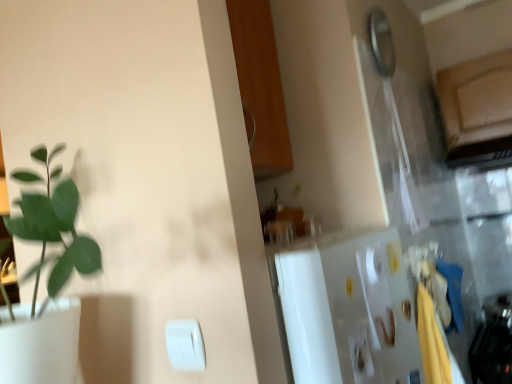
The height and width of the screenshot is (384, 512). What do you see at coordinates (360, 356) in the screenshot?
I see `white plastic light switch at lower center, the second light switch positioned from the front` at bounding box center [360, 356].

Image resolution: width=512 pixels, height=384 pixels. I want to click on white plastic light switch at lower center, marked as the 1th light switch in a back-to-front arrangement, so click(x=360, y=356).

Measure the distance between white plastic light switch at lower center, the 1th light switch in the right-to-left sequence, and camera.

white plastic light switch at lower center, the 1th light switch in the right-to-left sequence, is 31.51 inches away from camera.

Describe the element at coordinates (185, 345) in the screenshot. I see `white plastic light switch at lower center, marked as the first light switch in a front-to-back arrangement` at that location.

Measure the distance between white plastic light switch at lower center, placed as the second light switch when sorted from right to left, and camera.

71.07 centimeters.

Locate an element on the screen. This screenshot has height=384, width=512. white plastic light switch at lower center, placed as the second light switch when sorted from right to left is located at coordinates (185, 345).

This screenshot has width=512, height=384. Find the location of `white plastic light switch at lower center, which is the second light switch from left to right`. white plastic light switch at lower center, which is the second light switch from left to right is located at coordinates (360, 356).

Is white plastic light switch at lower center, which is the second light switch from left to right, to the left or to the right of white plastic light switch at lower center, placed as the 1th light switch when sorted from left to right, in the image?

white plastic light switch at lower center, which is the second light switch from left to right, is to the right of white plastic light switch at lower center, placed as the 1th light switch when sorted from left to right.

Which is behind, white plastic light switch at lower center, which is the second light switch from left to right, or white plastic light switch at lower center, placed as the 1th light switch when sorted from left to right?

white plastic light switch at lower center, which is the second light switch from left to right, is further away from the camera.

Is point (353, 349) positioned after point (174, 350)?

Yes, point (353, 349) is behind point (174, 350).

In the scene shown: From the image's perspective, which object appears higher, white plastic light switch at lower center, marked as the 1th light switch in a back-to-front arrangement, or white plastic light switch at lower center, which is counted as the 2th light switch, starting from the back?

From the image's view, white plastic light switch at lower center, which is counted as the 2th light switch, starting from the back, is above.

From a real-world perspective, is white plastic light switch at lower center, the second light switch positioned from the front, beneath white plastic light switch at lower center, placed as the 1th light switch when sorted from left to right?

Indeed, from a real-world perspective, white plastic light switch at lower center, the second light switch positioned from the front, is positioned beneath white plastic light switch at lower center, placed as the 1th light switch when sorted from left to right.

Consider the image. Considering the sizes of white plastic light switch at lower center, which is the second light switch from left to right, and white plastic light switch at lower center, placed as the 1th light switch when sorted from left to right, in the image, is white plastic light switch at lower center, which is the second light switch from left to right, wider or thinner than white plastic light switch at lower center, placed as the 1th light switch when sorted from left to right,?

white plastic light switch at lower center, which is the second light switch from left to right, is wider than white plastic light switch at lower center, placed as the 1th light switch when sorted from left to right.

Considering the sizes of objects white plastic light switch at lower center, the 1th light switch in the right-to-left sequence, and white plastic light switch at lower center, which is counted as the 2th light switch, starting from the back, in the image provided, who is taller, white plastic light switch at lower center, the 1th light switch in the right-to-left sequence, or white plastic light switch at lower center, which is counted as the 2th light switch, starting from the back,?

With more height is white plastic light switch at lower center, the 1th light switch in the right-to-left sequence.

Considering the sizes of objects white plastic light switch at lower center, marked as the 1th light switch in a back-to-front arrangement, and white plastic light switch at lower center, marked as the first light switch in a front-to-back arrangement, in the image provided, who is smaller, white plastic light switch at lower center, marked as the 1th light switch in a back-to-front arrangement, or white plastic light switch at lower center, marked as the first light switch in a front-to-back arrangement,?

With smaller size is white plastic light switch at lower center, marked as the first light switch in a front-to-back arrangement.

Is white plastic light switch at lower center, marked as the 1th light switch in a back-to-front arrangement, outside of white plastic light switch at lower center, which is counted as the 2th light switch, starting from the back?

Indeed, white plastic light switch at lower center, marked as the 1th light switch in a back-to-front arrangement, is completely outside white plastic light switch at lower center, which is counted as the 2th light switch, starting from the back.

Is white plastic light switch at lower center, the 1th light switch in the right-to-left sequence, directly adjacent to white plastic light switch at lower center, placed as the 1th light switch when sorted from left to right?

No, white plastic light switch at lower center, the 1th light switch in the right-to-left sequence, is not making contact with white plastic light switch at lower center, placed as the 1th light switch when sorted from left to right.

Is white plastic light switch at lower center, the second light switch positioned from the front, oriented away from white plastic light switch at lower center, placed as the second light switch when sorted from right to left?

No, white plastic light switch at lower center, the second light switch positioned from the front,'s orientation is not away from white plastic light switch at lower center, placed as the second light switch when sorted from right to left.

Could you measure the distance between white plastic light switch at lower center, which is the second light switch from left to right, and white plastic light switch at lower center, which is counted as the 2th light switch, starting from the back?

31.67 centimeters.

At what (x,y) coordinates should I click in order to perform the action: click on light switch in front of the white plastic light switch at lower center, marked as the 1th light switch in a back-to-front arrangement. Please return your answer as a coordinate pair (x, y). Image resolution: width=512 pixels, height=384 pixels. Looking at the image, I should click on click(185, 345).

Does white plastic light switch at lower center, marked as the first light switch in a front-to-back arrangement, appear on the right side of white plastic light switch at lower center, marked as the 1th light switch in a back-to-front arrangement?

No.

Is the depth of white plastic light switch at lower center, marked as the first light switch in a front-to-back arrangement, greater than that of white plastic light switch at lower center, which is the second light switch from left to right?

No, white plastic light switch at lower center, marked as the first light switch in a front-to-back arrangement, is closer to the viewer.

Does point (183, 366) come closer to viewer compared to point (369, 356)?

Yes, it is.

From the image's perspective, is white plastic light switch at lower center, marked as the first light switch in a front-to-back arrangement, positioned above or below white plastic light switch at lower center, marked as the 1th light switch in a back-to-front arrangement?

white plastic light switch at lower center, marked as the first light switch in a front-to-back arrangement, is situated higher than white plastic light switch at lower center, marked as the 1th light switch in a back-to-front arrangement, in the image.

From a real-world perspective, which object rests below the other?

From a 3D spatial view, white plastic light switch at lower center, marked as the 1th light switch in a back-to-front arrangement, is below.

Considering the relative sizes of white plastic light switch at lower center, marked as the first light switch in a front-to-back arrangement, and white plastic light switch at lower center, which is the second light switch from left to right, in the image provided, is white plastic light switch at lower center, marked as the first light switch in a front-to-back arrangement, thinner than white plastic light switch at lower center, which is the second light switch from left to right,?

Yes.

Considering the sizes of white plastic light switch at lower center, placed as the second light switch when sorted from right to left, and white plastic light switch at lower center, marked as the 1th light switch in a back-to-front arrangement, in the image, is white plastic light switch at lower center, placed as the second light switch when sorted from right to left, taller or shorter than white plastic light switch at lower center, marked as the 1th light switch in a back-to-front arrangement,?

In the image, white plastic light switch at lower center, placed as the second light switch when sorted from right to left, appears to be shorter than white plastic light switch at lower center, marked as the 1th light switch in a back-to-front arrangement.

In terms of size, does white plastic light switch at lower center, marked as the first light switch in a front-to-back arrangement, appear bigger or smaller than white plastic light switch at lower center, marked as the 1th light switch in a back-to-front arrangement?

white plastic light switch at lower center, marked as the first light switch in a front-to-back arrangement, is smaller than white plastic light switch at lower center, marked as the 1th light switch in a back-to-front arrangement.

Would you say white plastic light switch at lower center, marked as the first light switch in a front-to-back arrangement, is inside or outside white plastic light switch at lower center, the 1th light switch in the right-to-left sequence?

white plastic light switch at lower center, marked as the first light switch in a front-to-back arrangement, is not enclosed by white plastic light switch at lower center, the 1th light switch in the right-to-left sequence.

Is the surface of white plastic light switch at lower center, placed as the 1th light switch when sorted from left to right, in direct contact with white plastic light switch at lower center, marked as the 1th light switch in a back-to-front arrangement?

white plastic light switch at lower center, placed as the 1th light switch when sorted from left to right, is not next to white plastic light switch at lower center, marked as the 1th light switch in a back-to-front arrangement, and they're not touching.

Does white plastic light switch at lower center, placed as the 1th light switch when sorted from left to right, turn towards white plastic light switch at lower center, the 1th light switch in the right-to-left sequence?

No, white plastic light switch at lower center, placed as the 1th light switch when sorted from left to right, is not turned towards white plastic light switch at lower center, the 1th light switch in the right-to-left sequence.

How many degrees apart are the facing directions of white plastic light switch at lower center, placed as the 1th light switch when sorted from left to right, and white plastic light switch at lower center, marked as the 1th light switch in a back-to-front arrangement?

There is a 92.1-degree angle between the facing directions of white plastic light switch at lower center, placed as the 1th light switch when sorted from left to right, and white plastic light switch at lower center, marked as the 1th light switch in a back-to-front arrangement.

Measure the distance between white plastic light switch at lower center, marked as the first light switch in a front-to-back arrangement, and white plastic light switch at lower center, marked as the 1th light switch in a back-to-front arrangement.

white plastic light switch at lower center, marked as the first light switch in a front-to-back arrangement, and white plastic light switch at lower center, marked as the 1th light switch in a back-to-front arrangement, are 12.47 inches apart from each other.

The image size is (512, 384). Find the location of `light switch behind the white plastic light switch at lower center, which is counted as the 2th light switch, starting from the back`. light switch behind the white plastic light switch at lower center, which is counted as the 2th light switch, starting from the back is located at coordinates pos(360,356).

You are a GUI agent. You are given a task and a screenshot of the screen. Output one action in this format:
    pyautogui.click(x=<x>, y=<y>)
    Task: Click on the light switch below the white plastic light switch at lower center, which is counted as the 2th light switch, starting from the back (from a real-world perspective)
    
    Given the screenshot: What is the action you would take?
    pyautogui.click(x=360, y=356)

I want to click on light switch below the white plastic light switch at lower center, which is counted as the 2th light switch, starting from the back (from the image's perspective), so click(360, 356).